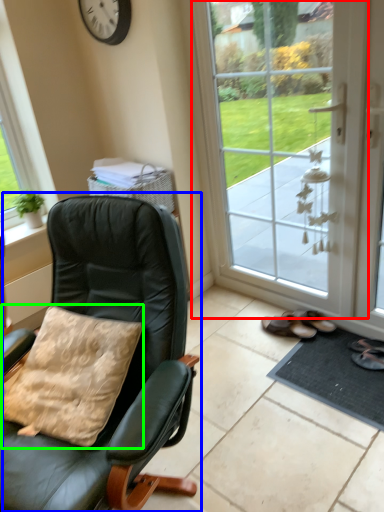
Question: Which is nearer to the door (highlighted by a red box)? chair (highlighted by a blue box) or pillow (highlighted by a green box).

Choices:
 (A) chair
 (B) pillow

Answer: (A)